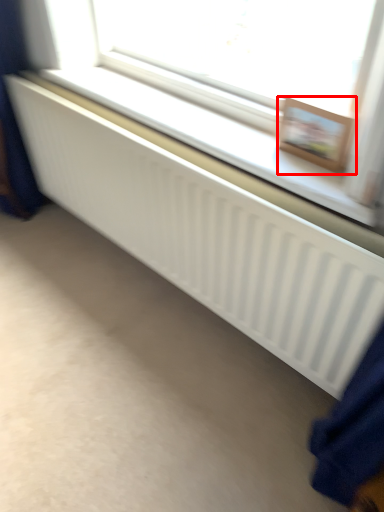
Question: Considering the relative positions of picture frame (annotated by the red box) and bay window in the image provided, where is picture frame (annotated by the red box) located with respect to the staircase?

Choices:
 (A) right
 (B) left

Answer: (A)